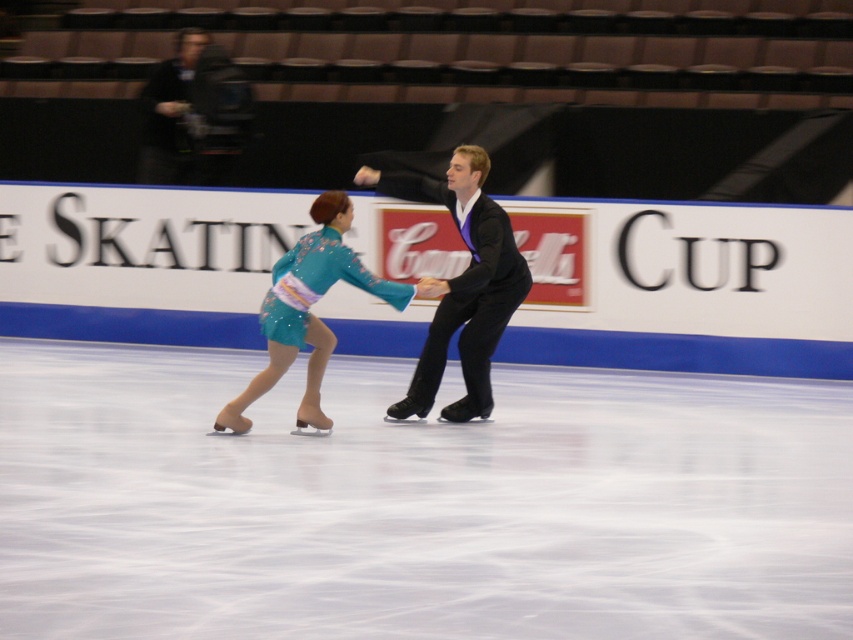
Question: Does white smooth ice at center have a lesser width compared to shiny black suit at center?

Choices:
 (A) yes
 (B) no

Answer: (B)

Question: Which point is closer to the camera?

Choices:
 (A) teal satin dress at center
 (B) white smooth ice at center
 (C) shiny black suit at center

Answer: (B)

Question: Can you confirm if white smooth ice at center is positioned to the left of shiny black suit at center?

Choices:
 (A) no
 (B) yes

Answer: (B)

Question: Estimate the real-world distances between objects in this image. Which object is closer to the teal satin dress at center?

Choices:
 (A) white smooth ice at center
 (B) shiny black suit at center

Answer: (B)

Question: Can you confirm if white smooth ice at center is smaller than shiny black suit at center?

Choices:
 (A) no
 (B) yes

Answer: (A)

Question: Which object appears closest to the camera in this image?

Choices:
 (A) teal satin dress at center
 (B) white smooth ice at center

Answer: (B)